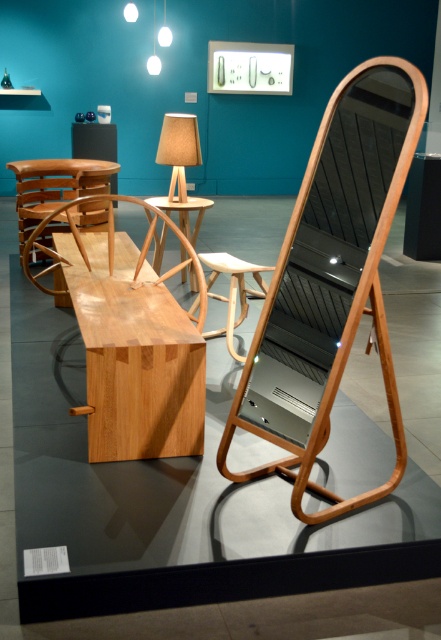
Question: Can you confirm if beige fabric lampshade at center is positioned above wooden table at center?

Choices:
 (A) yes
 (B) no

Answer: (A)

Question: Is natural wood bench at center closer to the viewer compared to beige fabric lampshade at center?

Choices:
 (A) yes
 (B) no

Answer: (A)

Question: Which point is closer to the camera?

Choices:
 (A) (395, 100)
 (B) (127, 237)

Answer: (A)

Question: Among these objects, which one is farthest from the camera?

Choices:
 (A) beige fabric lampshade at center
 (B) natural wood rocking chair at center
 (C) natural wood bench at center
 (D) wooden table at center

Answer: (A)

Question: Which of the following is the farthest from the observer?

Choices:
 (A) wooden table at center
 (B) beige fabric lampshade at center
 (C) natural wood rocking chair at center
 (D) natural wood bench at center

Answer: (B)

Question: Does natural wood bench at center have a lesser width compared to beige fabric lampshade at center?

Choices:
 (A) yes
 (B) no

Answer: (B)